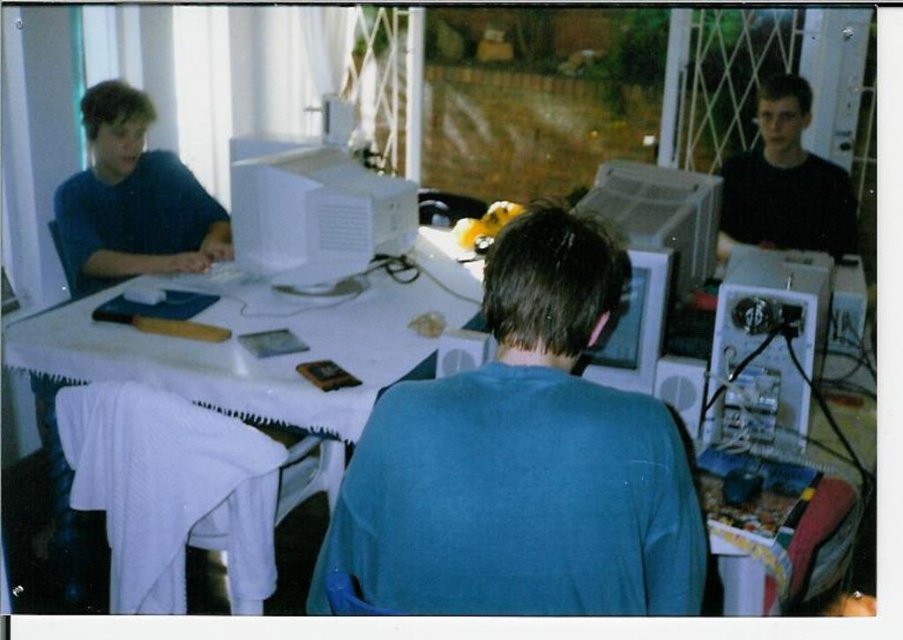
Question: Among these objects, which one is nearest to the camera?

Choices:
 (A) matte white monitor at center
 (B) dark blue shirt at left
 (C) black matte shirt at upper right

Answer: (A)

Question: Which object appears closest to the camera in this image?

Choices:
 (A) white cloth-covered table at center
 (B) matte plastic monitor at center
 (C) dark blue shirt at left
 (D) blue matte shirt at center

Answer: (D)

Question: Which of the following is the farthest from the observer?

Choices:
 (A) (649, 292)
 (B) (299, 177)

Answer: (B)

Question: Is metallic silver computer at right above matte white monitor at center?

Choices:
 (A) no
 (B) yes

Answer: (A)

Question: Can you confirm if white plastic desktop computer at center is thinner than matte white monitor at center?

Choices:
 (A) no
 (B) yes

Answer: (A)

Question: Is white plastic desktop computer at center thinner than metallic silver computer at right?

Choices:
 (A) no
 (B) yes

Answer: (A)